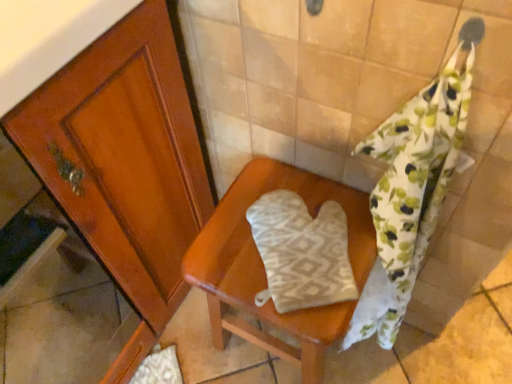
Where is `free space above beige fabric oven mitt at center (from a real-world perspective)`? The width and height of the screenshot is (512, 384). free space above beige fabric oven mitt at center (from a real-world perspective) is located at coordinates (287, 252).